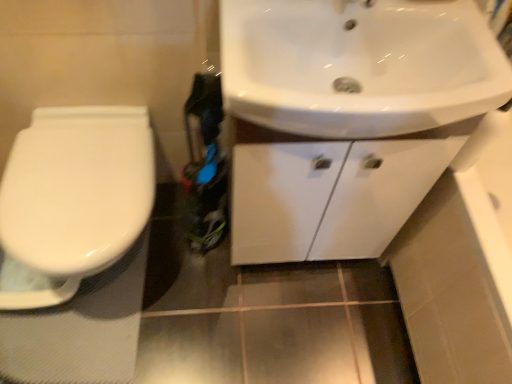
Question: Do you think white glossy cabinet at upper right is within white glossy sink at upper right, or outside of it?

Choices:
 (A) inside
 (B) outside

Answer: (B)

Question: From the image's perspective, relative to white glossy sink at upper right, is white glossy cabinet at upper right above or below?

Choices:
 (A) above
 (B) below

Answer: (B)

Question: Considering the real-world distances, which object is farthest from the white glossy sink at upper right?

Choices:
 (A) white glossy toilet at left
 (B) white glossy cabinet at upper right

Answer: (A)

Question: Based on their relative distances, which object is farther from the white glossy cabinet at upper right?

Choices:
 (A) white glossy sink at upper right
 (B) white glossy toilet at left

Answer: (B)